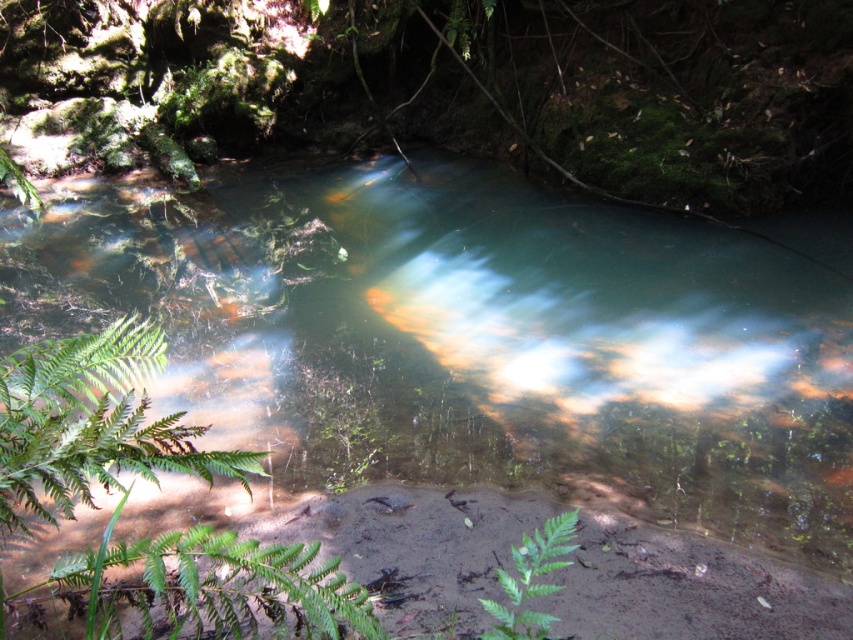
Question: Can you confirm if green leafy fern at lower left is positioned to the left of green leafy fern at lower center?

Choices:
 (A) no
 (B) yes

Answer: (B)

Question: Which object is positioned farthest from the green leafy fern at lower left?

Choices:
 (A) clear water stream at center
 (B) green leafy fern at lower center

Answer: (A)

Question: Does clear water stream at center have a larger size compared to green leafy fern at lower left?

Choices:
 (A) yes
 (B) no

Answer: (A)

Question: Is clear water stream at center behind green leafy fern at lower center?

Choices:
 (A) no
 (B) yes

Answer: (B)

Question: Which object appears farthest from the camera in this image?

Choices:
 (A) green leafy fern at lower center
 (B) green leafy fern at lower left

Answer: (A)

Question: Which point is farther to the camera?

Choices:
 (A) (674, 410)
 (B) (491, 604)

Answer: (A)